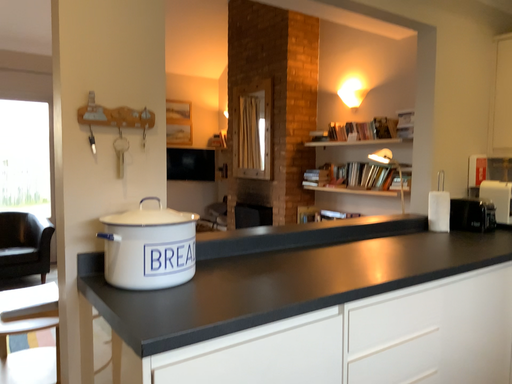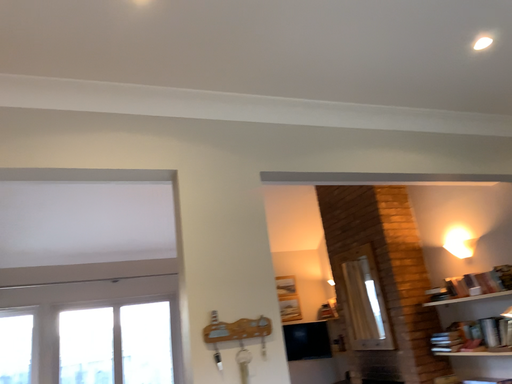
Question: Which way did the camera rotate in the video?

Choices:
 (A) rotated left
 (B) rotated right

Answer: (A)